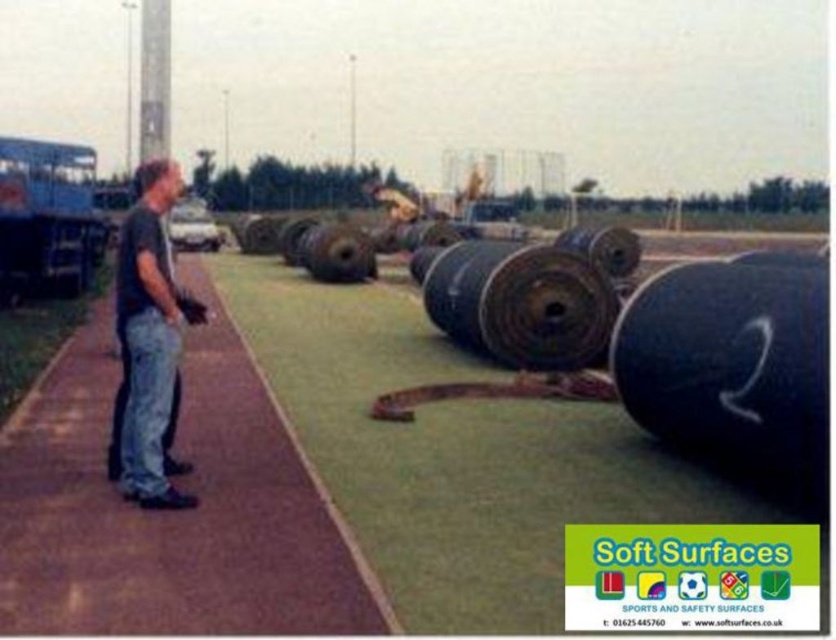
You are standing at the position of the man in the image. You see two points marked on the ground. The first point is at coordinate point (x=153, y=369) and the second point is at coordinate point (x=327, y=228). Which point is closer to you?

Point (x=153, y=369) is closer to the camera than point (x=327, y=228), so the first point is closer to you.